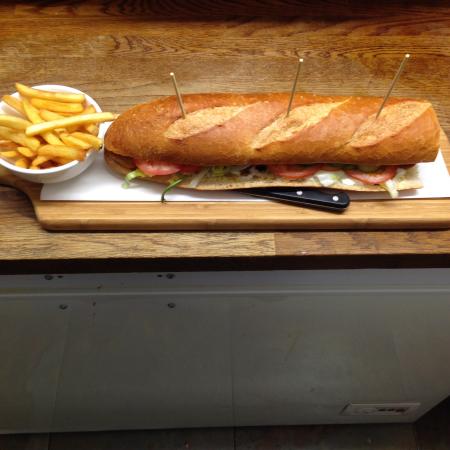
Find the location of a particular element. Image resolution: width=450 pixels, height=450 pixels. 1 white bowl is located at coordinates (41, 171).